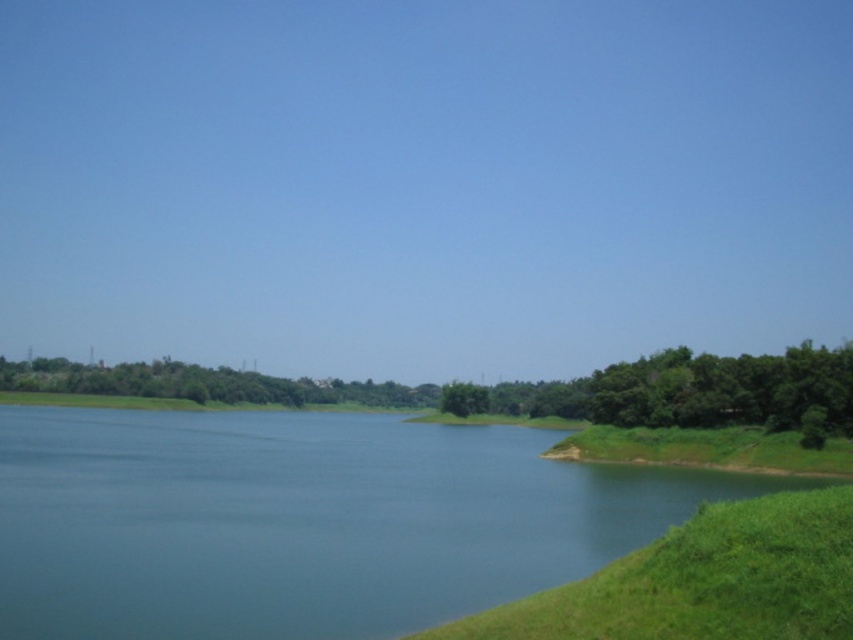
Who is shorter, blue water at lower left or green leafy trees at center?

Standing shorter between the two is blue water at lower left.

Who is positioned more to the left, blue water at lower left or green leafy trees at center?

green leafy trees at center

Describe the element at coordinates (305, 522) in the screenshot. I see `blue water at lower left` at that location.

What are the coordinates of `blue water at lower left` in the screenshot? It's located at (305, 522).

Between green grassy slope at lower right and green leafy trees at center, which one has less height?

Standing shorter between the two is green grassy slope at lower right.

Where is `green grassy slope at lower right`? Image resolution: width=853 pixels, height=640 pixels. green grassy slope at lower right is located at coordinates (703, 580).

What do you see at coordinates (703, 580) in the screenshot?
I see `green grassy slope at lower right` at bounding box center [703, 580].

The image size is (853, 640). I want to click on green grassy slope at lower right, so click(703, 580).

Who is higher up, green grassy slope at lower right or green leafy trees at right?

green grassy slope at lower right is above.

Is green grassy slope at lower right shorter than green leafy trees at right?

Correct, green grassy slope at lower right is not as tall as green leafy trees at right.

What do you see at coordinates (703, 580) in the screenshot? The image size is (853, 640). I see `green grassy slope at lower right` at bounding box center [703, 580].

Where is `green grassy slope at lower right`? This screenshot has width=853, height=640. green grassy slope at lower right is located at coordinates (703, 580).